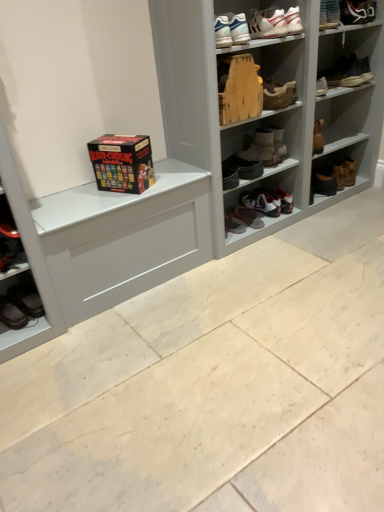
I want to click on free spot in front of black leather shoes at lower left, which appears as the first footwear when viewed from the left, so click(12, 338).